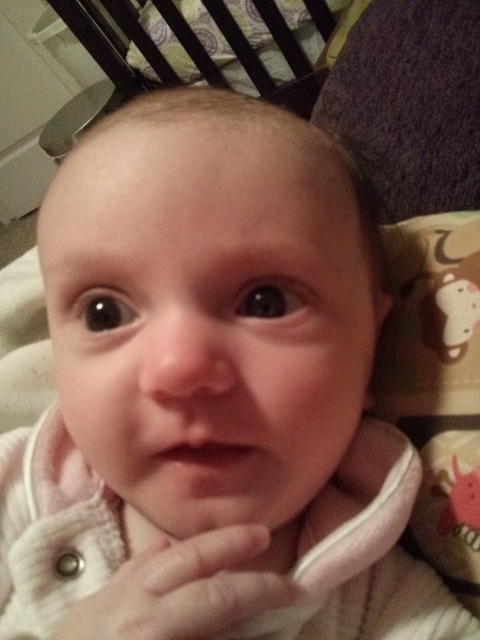
You are a parent holding a baby. You notice the white soft fabric hand at center and the wooden slats at upper center in the room. If you want to place a small toy between them, will there be enough space?

The white soft fabric hand at center is 5.55 feet away from the wooden slats at upper center. Since 5.55 feet is a considerable distance, placing a small toy between them should be possible as there is sufficient space available.

You are an AI analyzing the image. The scene shows a baby touching their chin with their hand. Where is the white soft fabric hand at center located in terms of coordinates?

The white soft fabric hand at center is located at coordinates point (181, 589).